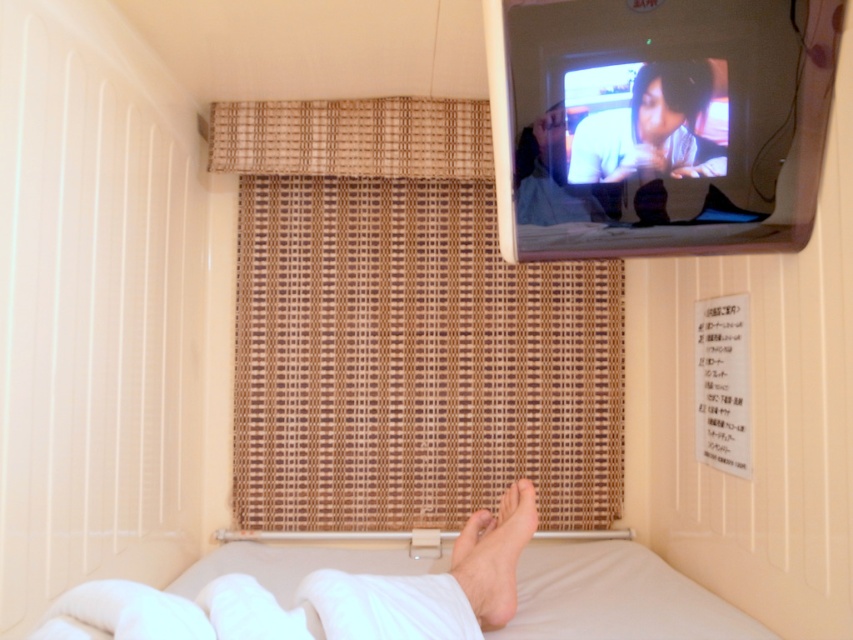
Question: Considering the relative positions of matte black shirt at upper right and smooth skin face at upper center in the image provided, where is matte black shirt at upper right located with respect to smooth skin face at upper center?

Choices:
 (A) below
 (B) above

Answer: (B)

Question: Estimate the real-world distances between objects in this image. Which object is closer to the white soft bed at lower center?

Choices:
 (A) smooth skin face at upper center
 (B) white soft foot at lower center
 (C) bamboo curtain at upper center
 (D) matte black shirt at upper right

Answer: (B)

Question: Does bamboo curtain at upper center have a smaller size compared to matte black shirt at upper right?

Choices:
 (A) yes
 (B) no

Answer: (B)

Question: Considering the real-world distances, which object is closest to the white soft bed at lower center?

Choices:
 (A) matte black shirt at upper right
 (B) white soft foot at lower center
 (C) smooth skin face at upper center

Answer: (B)

Question: Can you confirm if white soft bed at lower center is thinner than matte black shirt at upper right?

Choices:
 (A) yes
 (B) no

Answer: (B)

Question: Which object appears farthest from the camera in this image?

Choices:
 (A) white soft bed at lower center
 (B) bamboo curtain at upper center

Answer: (B)